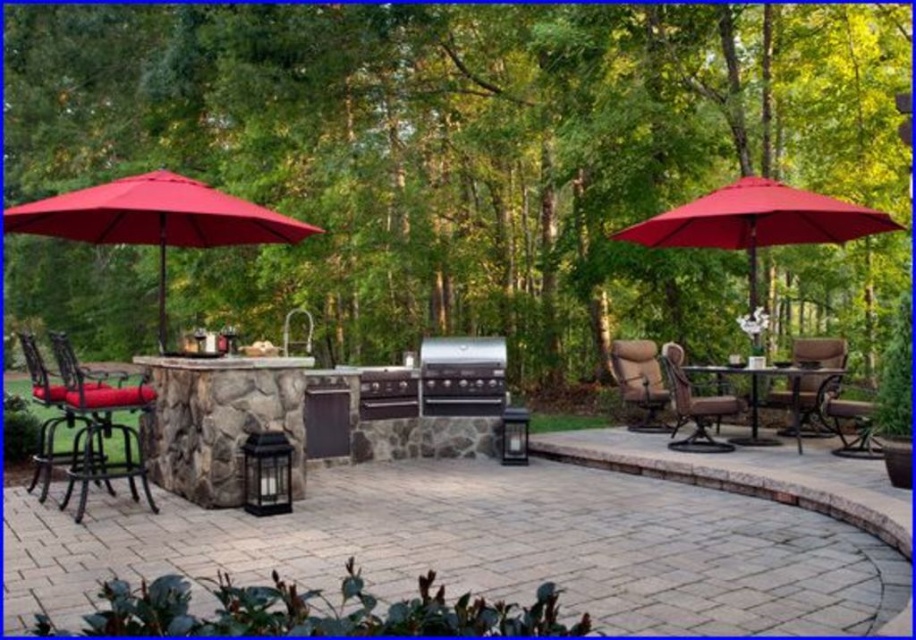
Question: Observing the image, what is the correct spatial positioning of brown fabric chair at center in reference to brown woven chair at center?

Choices:
 (A) left
 (B) right

Answer: (A)

Question: Considering the real-world distances, which object is farthest from the brown leather chair at right?

Choices:
 (A) metallic black bar stool at lower left
 (B) red fabric umbrella at upper right
 (C) brown fabric chair at center
 (D) red fabric umbrella at left

Answer: (A)

Question: Which of the following is the closest to the observer?

Choices:
 (A) (795, 401)
 (B) (48, 234)
 (C) (500, 368)
 (D) (745, 209)

Answer: (B)

Question: Which object is the farthest from the black stainless steel grill at center?

Choices:
 (A) red fabric umbrella at upper right
 (B) metallic black bar stool at lower left
 (C) brown woven chair at center

Answer: (B)

Question: Does red fabric umbrella at left come in front of brown woven chair at center?

Choices:
 (A) no
 (B) yes

Answer: (B)

Question: Is metallic black bar stool at lower left smaller than black stainless steel grill at center?

Choices:
 (A) yes
 (B) no

Answer: (B)